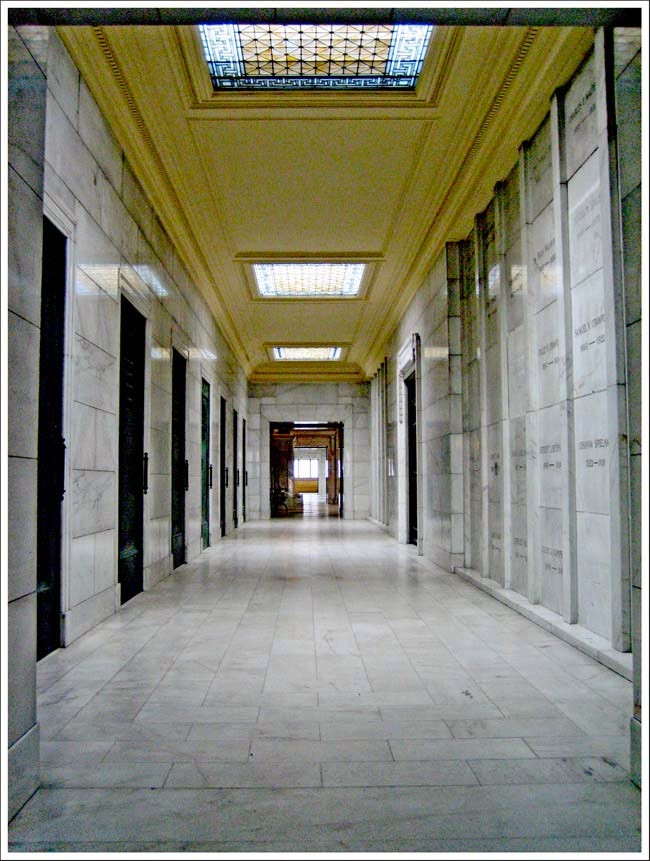
The image size is (650, 861). In order to click on one long tile in this screenshot , I will do `click(325, 838)`.